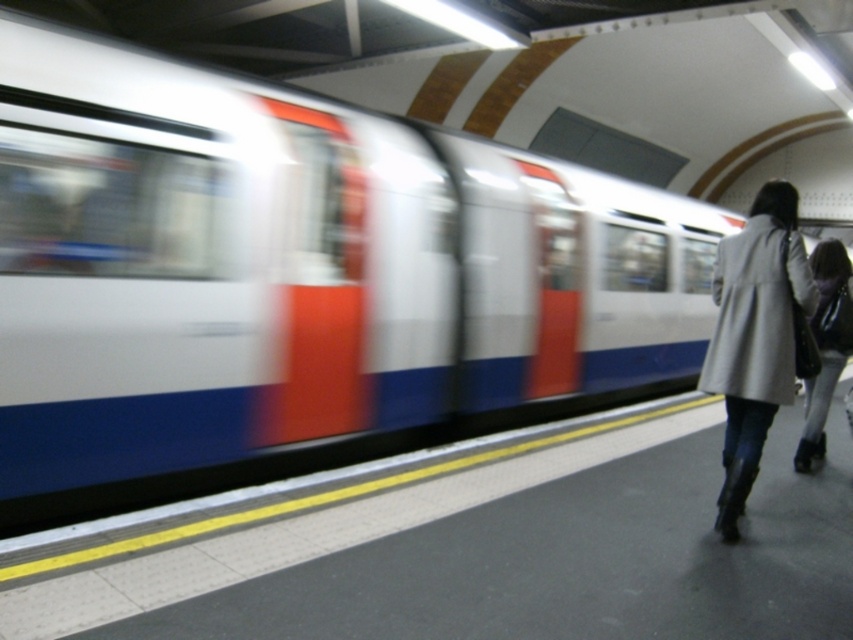
From the picture: You are a photographer trying to capture a photo of both the gray wool coat at right and the matte gray coat at right. Since you want to ensure both coats are fully visible in the frame, which coat should you focus on to account for their sizes?

The gray wool coat at right has a lesser width compared to matte gray coat at right, so you should focus on the matte gray coat at right as it is wider and requires more space in the frame to be fully captured.

You are a photographer standing on the subway platform. You want to take a photo of both the gray wool coat at right and the matte gray coat at right. Which coat should you frame first in your camera viewfinder to capture them both in the shot?

The gray wool coat at right is positioned on the left side of matte gray coat at right, so you should frame the gray wool coat at right first to ensure both coats are included in the shot.

You are standing at the subway station and see the point marked at coordinate (753, 336). What object is located at that point?

The point at coordinate (753, 336) corresponds to the gray wool coat at right.